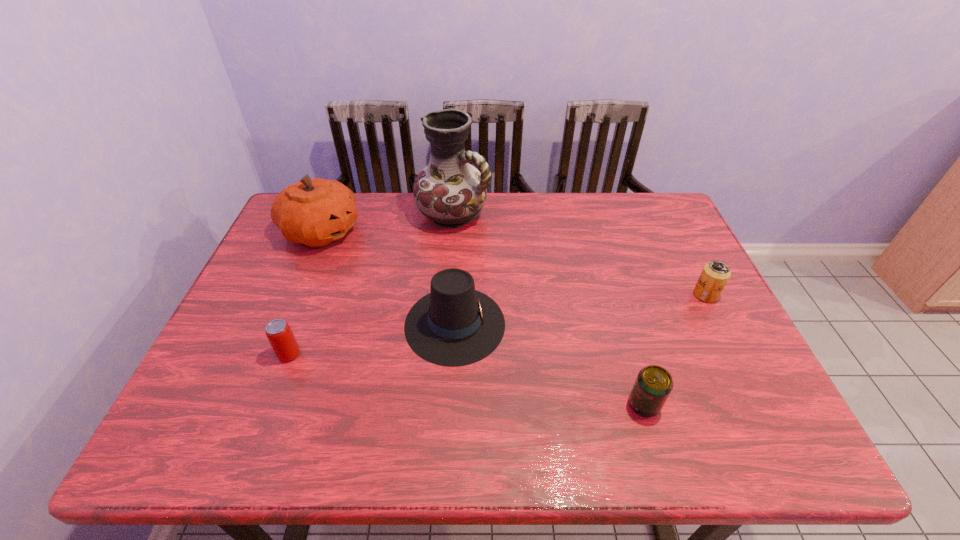
Locate an element on the screen. The height and width of the screenshot is (540, 960). the tallest object is located at coordinates (451, 192).

Where is `pumpkin`? Image resolution: width=960 pixels, height=540 pixels. pumpkin is located at coordinates (315, 212).

At what (x,y) coordinates should I click in order to perform the action: click on hat. Please return your answer as a coordinate pair (x, y). The image size is (960, 540). Looking at the image, I should click on (454, 325).

Locate an element on the screen. Image resolution: width=960 pixels, height=540 pixels. the farthest beer can is located at coordinates (715, 274).

You are a GUI agent. You are given a task and a screenshot of the screen. Output one action in this format:
    pyautogui.click(x=<x>, y=<y>)
    Task: Click on the rightmost object
    The width and height of the screenshot is (960, 540).
    Given the screenshot: What is the action you would take?
    pyautogui.click(x=715, y=274)

Find the location of a particular element. The height and width of the screenshot is (540, 960). the nearest beer can is located at coordinates (653, 385).

The height and width of the screenshot is (540, 960). In order to click on the second beer can from right to left in this screenshot , I will do `click(653, 385)`.

Locate an element on the screen. This screenshot has height=540, width=960. the leftmost beer can is located at coordinates pyautogui.click(x=282, y=340).

Identify the location of free space located 0.380m on the left of the vase. (300, 214).

This screenshot has width=960, height=540. What are the coordinates of `vacant space situated 0.220m on the front-facing side of the pumpkin` in the screenshot? It's located at (432, 231).